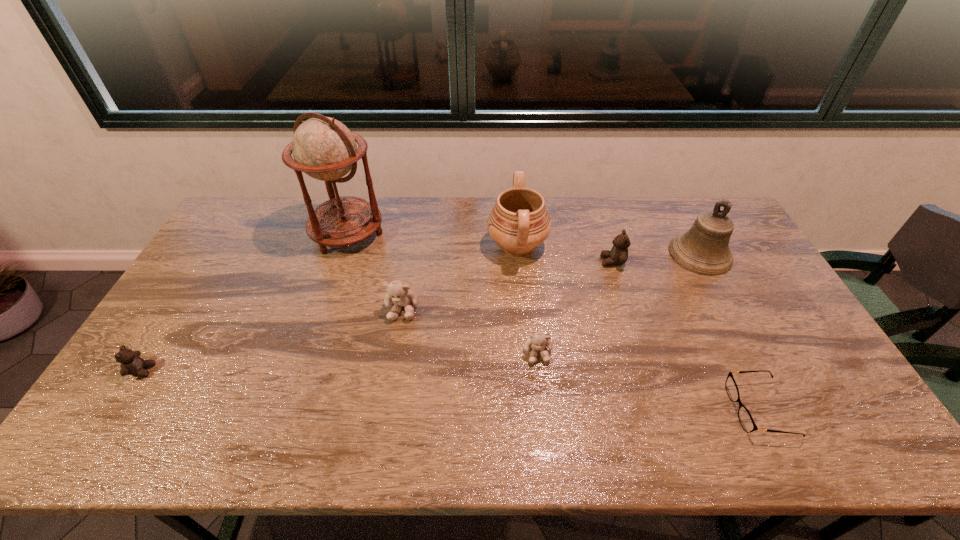
This screenshot has width=960, height=540. Find the location of `the seventh object from right to left`. the seventh object from right to left is located at coordinates (325, 149).

This screenshot has width=960, height=540. In order to click on globe in this screenshot , I will do `click(325, 149)`.

This screenshot has height=540, width=960. What are the coordinates of `urn` in the screenshot? It's located at (519, 222).

Where is `bell`? bell is located at coordinates (704, 249).

Where is `the rightmost teddy bear`? The width and height of the screenshot is (960, 540). the rightmost teddy bear is located at coordinates (618, 255).

Where is `the sixth object from left to right`? the sixth object from left to right is located at coordinates (618, 255).

This screenshot has height=540, width=960. What are the coordinates of `the third nearest teddy bear` in the screenshot? It's located at (398, 293).

Locate an element on the screen. The height and width of the screenshot is (540, 960). the farther gray teddy bear is located at coordinates point(398,293).

Where is `the nearer brown teddy bear`? The height and width of the screenshot is (540, 960). the nearer brown teddy bear is located at coordinates (131, 363).

The width and height of the screenshot is (960, 540). What are the coordinates of `the left brown teddy bear` in the screenshot? It's located at (131, 363).